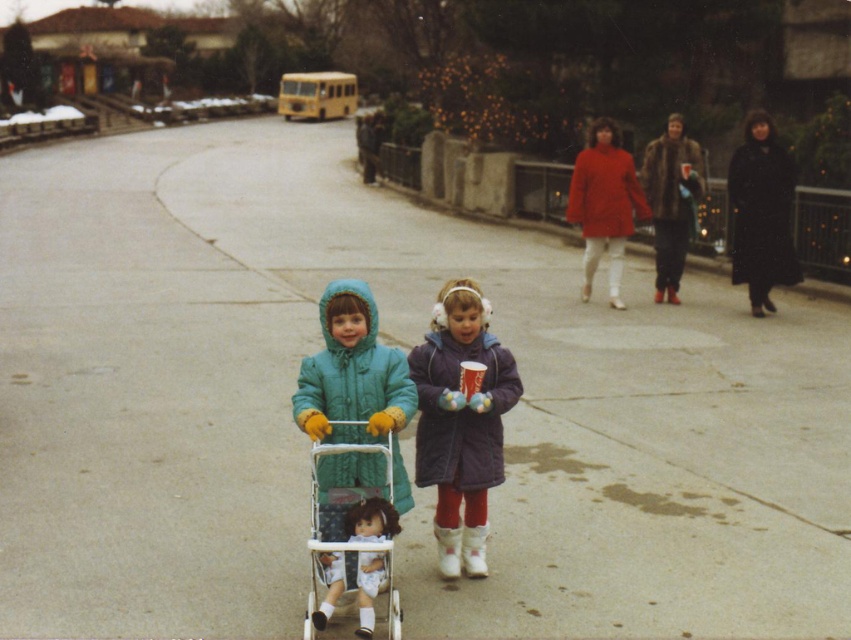
Question: Does purple matte coat at center come in front of white plastic baby carriage at center?

Choices:
 (A) yes
 (B) no

Answer: (B)

Question: Which point appears farthest from the camera in this image?

Choices:
 (A) (463, 488)
 (B) (357, 420)

Answer: (A)

Question: Can you confirm if purple matte coat at center is positioned to the right of white plastic baby carriage at center?

Choices:
 (A) yes
 (B) no

Answer: (A)

Question: Is purple matte coat at center positioned at the back of white plastic baby carriage at center?

Choices:
 (A) yes
 (B) no

Answer: (A)

Question: Which point is farther from the camera taking this photo?

Choices:
 (A) (437, 400)
 (B) (364, 557)

Answer: (A)